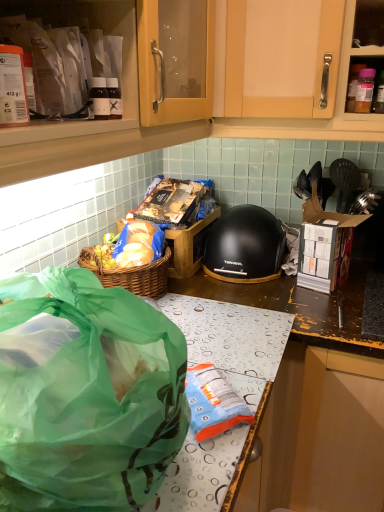
Question: Is point (246, 268) positioned closer to the camera than point (94, 385)?

Choices:
 (A) closer
 (B) farther

Answer: (B)

Question: From the image's perspective, relative to green translucent bag at lower left, is black matte helmet at center above or below?

Choices:
 (A) below
 (B) above

Answer: (B)

Question: Which object is positioned farthest from the matte plastic container at upper left?

Choices:
 (A) green translucent bag at lower left
 (B) black matte helmet at center

Answer: (B)

Question: Which of these objects is positioned closest to the green translucent bag at lower left?

Choices:
 (A) black matte helmet at center
 (B) matte plastic container at upper left

Answer: (B)